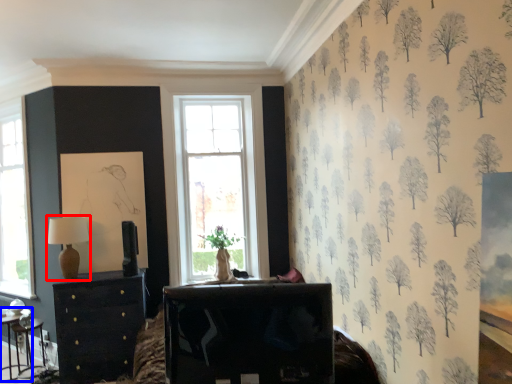
Question: Which object appears farthest to the camera in this image, table lamp (highlighted by a red box) or table (highlighted by a blue box)?

Choices:
 (A) table lamp
 (B) table

Answer: (B)